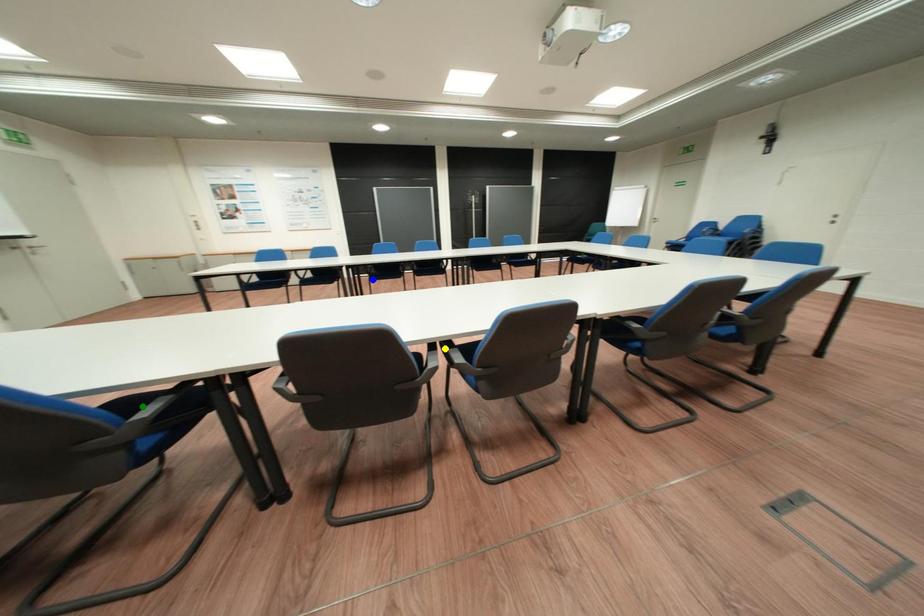
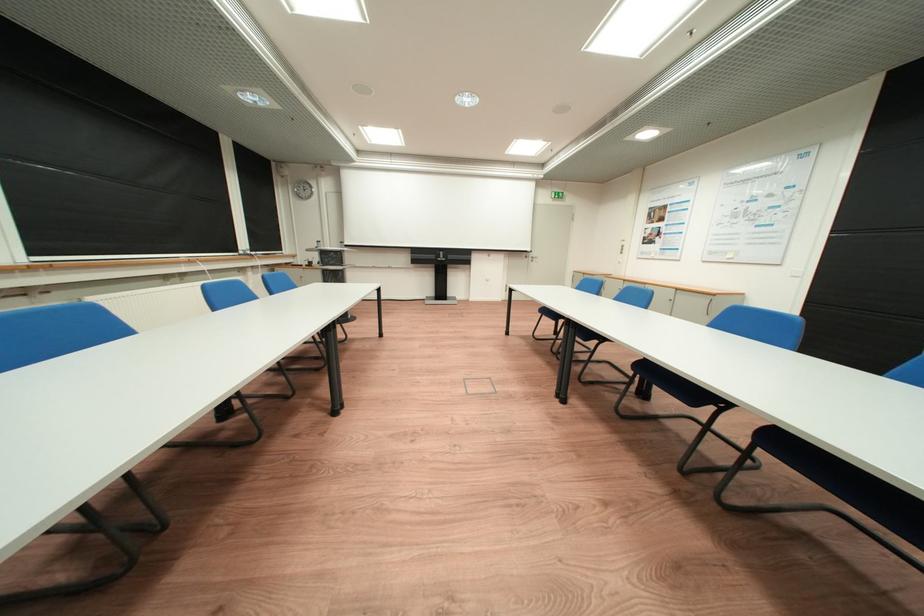
I am providing you with two images of the same scene from different viewpoints. Three points are marked in image1. Which point corresponds to a part or object that is occluded in image2?In image1, three points are marked. Which of them correspond to a part or object that is occluded in image2?Among the three points shown in image1, which one corresponds to a part or object that is no longer visible due to occlusion in image2?

blue point, green point, yellow point cannot be seen in image2.